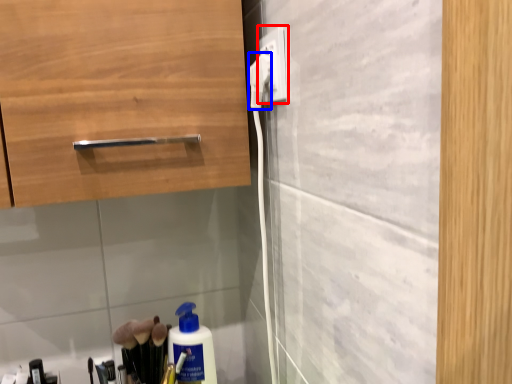
Question: Which object is closer to the camera taking this photo, electric outlet (highlighted by a red box) or electric outlet (highlighted by a blue box)?

Choices:
 (A) electric outlet
 (B) electric outlet

Answer: (A)